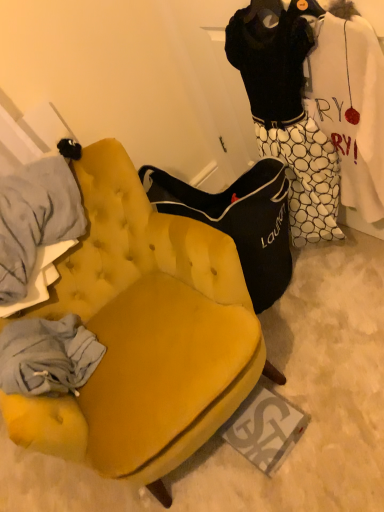
Find the location of a particular element. The height and width of the screenshot is (512, 384). black jersey at upper right is located at coordinates (287, 110).

Describe the element at coordinates (287, 110) in the screenshot. The image size is (384, 512). I see `black jersey at upper right` at that location.

What do you see at coordinates (144, 333) in the screenshot?
I see `velvet yellow chair at center` at bounding box center [144, 333].

Where is `velvet yellow chair at center`? Image resolution: width=384 pixels, height=512 pixels. velvet yellow chair at center is located at coordinates (144, 333).

Where is `black jersey at upper right`? black jersey at upper right is located at coordinates (287, 110).

Is black jersey at upper right to the left of velvet yellow chair at center from the viewer's perspective?

No.

Between black jersey at upper right and velvet yellow chair at center, which one is positioned behind?

black jersey at upper right is behind.

Does point (300, 109) appear closer or farther from the camera than point (121, 287)?

Clearly, point (300, 109) is closer to the camera than point (121, 287).

From the image's perspective, is black jersey at upper right under velvet yellow chair at center?

No, from the image's perspective, black jersey at upper right is not beneath velvet yellow chair at center.

From a real-world perspective, which object rests below the other?

In real-world perspective, velvet yellow chair at center is lower.

Considering the sizes of objects black jersey at upper right and velvet yellow chair at center in the image provided, who is thinner, black jersey at upper right or velvet yellow chair at center?

black jersey at upper right.

Can you confirm if black jersey at upper right is shorter than velvet yellow chair at center?

Incorrect, the height of black jersey at upper right does not fall short of that of velvet yellow chair at center.

Is black jersey at upper right bigger or smaller than velvet yellow chair at center?

Clearly, black jersey at upper right is smaller in size than velvet yellow chair at center.

Can velvet yellow chair at center be found inside black jersey at upper right?

No, velvet yellow chair at center is located outside of black jersey at upper right.

Is black jersey at upper right far away from velvet yellow chair at center?

Actually, black jersey at upper right and velvet yellow chair at center are a little close together.

Is black jersey at upper right facing towards velvet yellow chair at center?

Yes.

Can you tell me how much black jersey at upper right and velvet yellow chair at center differ in facing direction?

84.3 degrees.

In order to click on couple behind the velvet yellow chair at center in this screenshot , I will do `click(287, 110)`.

Which is more to the right, velvet yellow chair at center or black jersey at upper right?

black jersey at upper right is more to the right.

Is the depth of velvet yellow chair at center less than that of black jersey at upper right?

Yes, velvet yellow chair at center is in front of black jersey at upper right.

Considering the points (124, 442) and (254, 53), which point is behind, point (124, 442) or point (254, 53)?

The point (254, 53) is more distant.

In the scene shown: From the image's perspective, between velvet yellow chair at center and black jersey at upper right, who is located below?

velvet yellow chair at center.

From a real-world perspective, is velvet yellow chair at center located beneath black jersey at upper right?

Yes, from a real-world perspective, velvet yellow chair at center is under black jersey at upper right.

Considering the sizes of objects velvet yellow chair at center and black jersey at upper right in the image provided, who is thinner, velvet yellow chair at center or black jersey at upper right?

black jersey at upper right is thinner.

From their relative heights in the image, would you say velvet yellow chair at center is taller or shorter than black jersey at upper right?

Clearly, velvet yellow chair at center is shorter compared to black jersey at upper right.

Considering the sizes of velvet yellow chair at center and black jersey at upper right in the image, is velvet yellow chair at center bigger or smaller than black jersey at upper right?

velvet yellow chair at center is bigger than black jersey at upper right.

Is velvet yellow chair at center inside or outside of black jersey at upper right?

velvet yellow chair at center is located beyond the bounds of black jersey at upper right.

Is velvet yellow chair at center touching black jersey at upper right?

There is a gap between velvet yellow chair at center and black jersey at upper right.

Could you tell me if velvet yellow chair at center is facing black jersey at upper right?

No, velvet yellow chair at center is not facing towards black jersey at upper right.

At what (x,y) coordinates should I click in order to perform the action: click on couple behind the velvet yellow chair at center. Please return your answer as a coordinate pair (x, y). The image size is (384, 512). Looking at the image, I should click on (287, 110).

I want to click on couple to the right of velvet yellow chair at center, so click(x=287, y=110).

I want to click on couple above the velvet yellow chair at center (from the image's perspective), so click(287, 110).